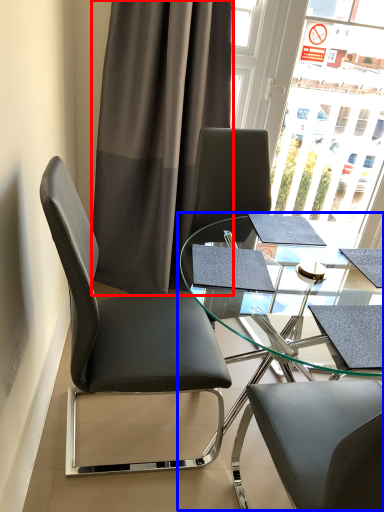
Question: Which object appears closest to the camera in this image, curtain (highlighted by a red box) or table (highlighted by a blue box)?

Choices:
 (A) curtain
 (B) table

Answer: (B)